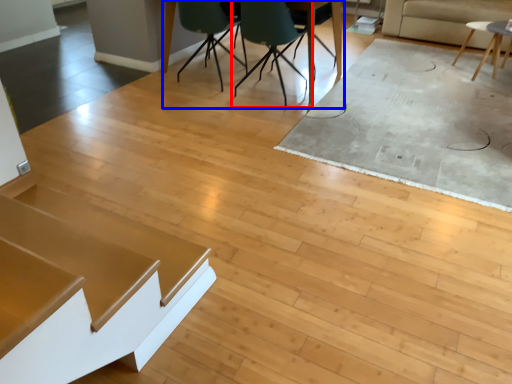
Question: Among these objects, which one is nearest to the camera, chair (highlighted by a red box) or table (highlighted by a blue box)?

Choices:
 (A) chair
 (B) table

Answer: (A)